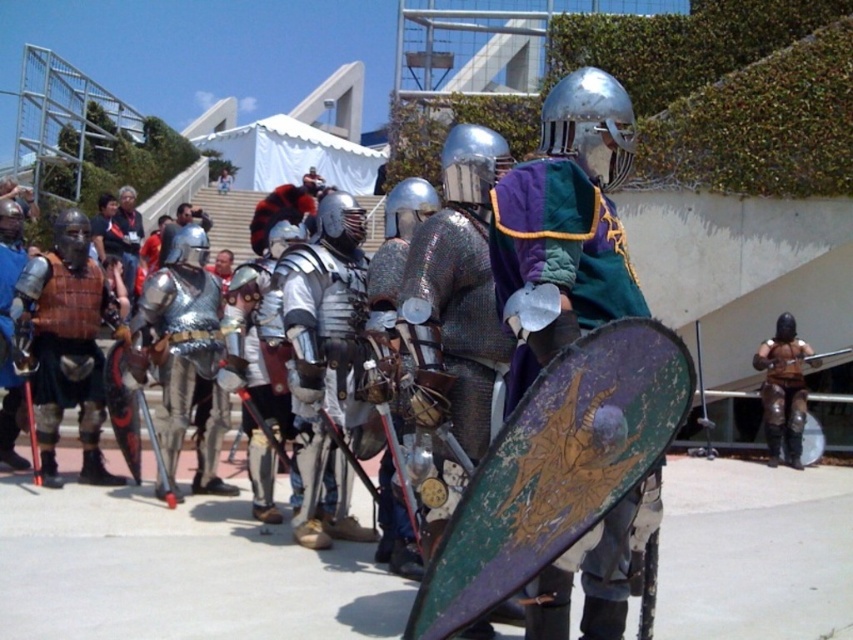
The image size is (853, 640). Describe the element at coordinates (564, 225) in the screenshot. I see `shiny silver helmet at center` at that location.

From the picture: Which is below, shiny silver helmet at center or brown leather armor at right?

Positioned lower is brown leather armor at right.

Is point (555, 572) closer to camera compared to point (787, 365)?

Yes, point (555, 572) is in front of point (787, 365).

Where is `shiny silver helmet at center`? This screenshot has width=853, height=640. shiny silver helmet at center is located at coordinates (564, 225).